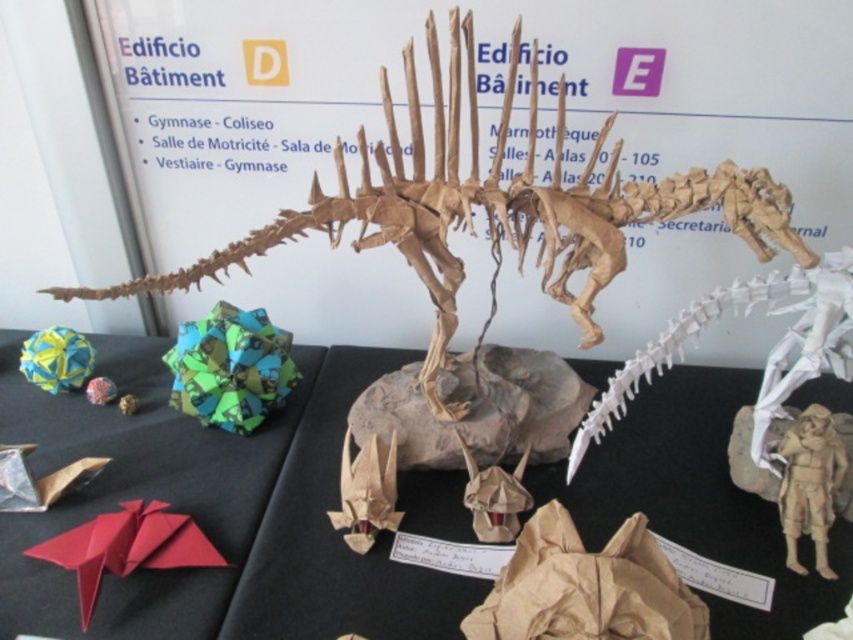
Can you confirm if black paper at center is thinner than white paper spine at center?

Incorrect, black paper at center's width is not less than white paper spine at center's.

Which is above, black paper at center or white paper spine at center?

Positioned higher is white paper spine at center.

At what (x,y) coordinates should I click in order to perform the action: click on black paper at center. Please return your answer as a coordinate pair (x, y). This screenshot has height=640, width=853. Looking at the image, I should click on (215, 512).

Does brown paper dinosaur at center have a greater height compared to white paper spine at center?

Indeed, brown paper dinosaur at center has a greater height compared to white paper spine at center.

Can you confirm if brown paper dinosaur at center is positioned to the left of white paper spine at center?

Yes, brown paper dinosaur at center is to the left of white paper spine at center.

Locate an element on the screen. The width and height of the screenshot is (853, 640). brown paper dinosaur at center is located at coordinates (492, 205).

This screenshot has height=640, width=853. In order to click on brown paper dinosaur at center in this screenshot , I will do `click(492, 205)`.

Measure the distance between black paper at center and brown paper dinosaur at center.

black paper at center is 46.48 centimeters from brown paper dinosaur at center.

Is point (15, 522) positioned behind point (312, 205)?

Yes, it is behind point (312, 205).

In order to click on black paper at center in this screenshot , I will do `click(215, 512)`.